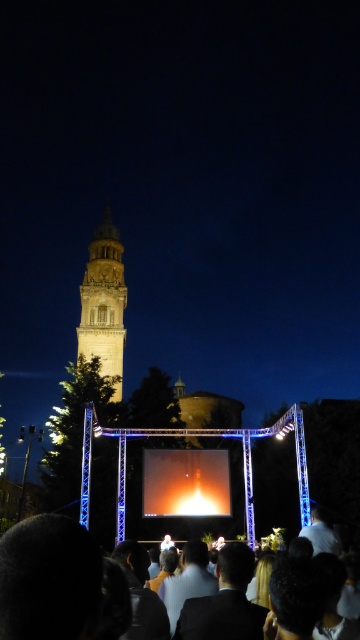
You are standing at the origin point of the coordinate system in the image. You want to join the dark suit crowd at lower center. What direction should you move in to reach them?

To reach the dark suit crowd at lower center, you should move towards the lower center direction since their position is at point (48, 580) in the coordinate system.

Looking at this image, you are an event photographer at the nighttime gathering. You want to capture a photo that includes both the light beige stone bell tower at center and the shiny orange rocket at center. Based on their positions, which object should you frame first in your camera viewfinder to ensure both are in the shot?

You should frame the light beige stone stone bell tower at center first since it is positioned to the left of the shiny orange rocket at center, allowing you to adjust the camera angle to include both objects in the frame.

You are an architect designing a new city park and want to place both the light beige stone bell tower at center and the shiny orange rocket at center in the park layout. Based on the image, which object should be placed higher to maintain the original proportions?

The light beige stone bell tower at center should be placed higher since it is much taller than the shiny orange rocket at center in the original image.